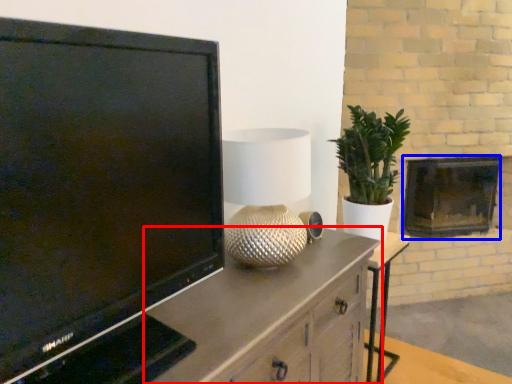
Question: Which point is closer to the camera, cabinetry (highlighted by a red box) or fireplace (highlighted by a blue box)?

Choices:
 (A) cabinetry
 (B) fireplace

Answer: (A)